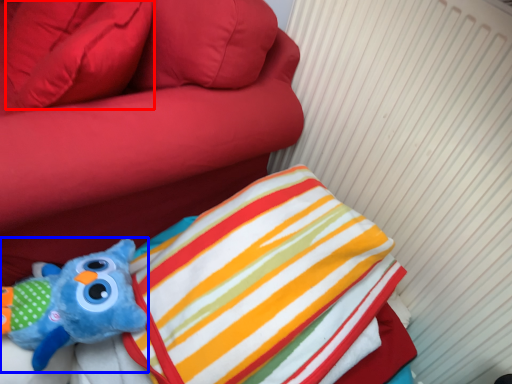
Question: Which object appears farthest to the camera in this image, pillow (highlighted by a red box) or toy (highlighted by a blue box)?

Choices:
 (A) pillow
 (B) toy

Answer: (A)